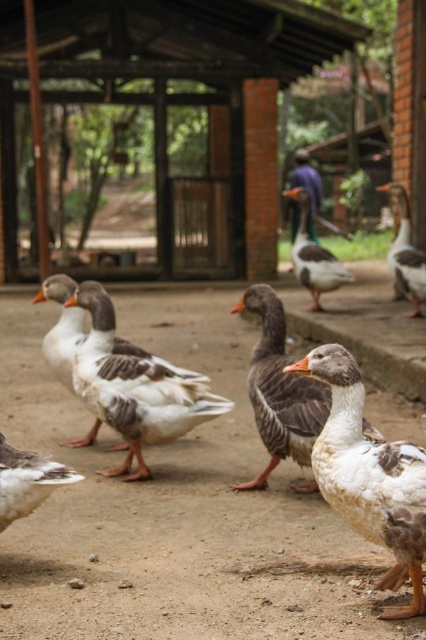
Who is taller, gray matte goose at center or white matte duck at lower left?

Standing taller between the two is gray matte goose at center.

Who is lower down, gray matte goose at center or white matte duck at lower left?

white matte duck at lower left is below.

Does point (279, 337) come in front of point (31, 499)?

No, it is not.

Identify the location of gray matte goose at center. (279, 388).

Is point (52, 100) less distant than point (302, 408)?

No, (52, 100) is further to viewer.

Does wooden structure at center have a greater height compared to gray matte goose at center?

Correct, wooden structure at center is much taller as gray matte goose at center.

Does point (229, 16) lie in front of point (255, 480)?

No, (229, 16) is behind (255, 480).

This screenshot has width=426, height=640. What are the coordinates of `wooden structure at center` in the screenshot? It's located at (196, 92).

Is white-gray feathered duck at center further to camera compared to white-feathered goose at center?

No, it is in front of white-feathered goose at center.

Is white-gray feathered duck at center positioned in front of white-feathered goose at center?

Yes.

Which is in front, point (365, 529) or point (189, 384)?

Point (365, 529)

You are a GUI agent. You are given a task and a screenshot of the screen. Output one action in this format:
    pyautogui.click(x=<x>, y=<y>)
    Task: Click on the white-gray feathered duck at center
    This screenshot has height=640, width=426.
    Given the screenshot: What is the action you would take?
    pyautogui.click(x=370, y=476)